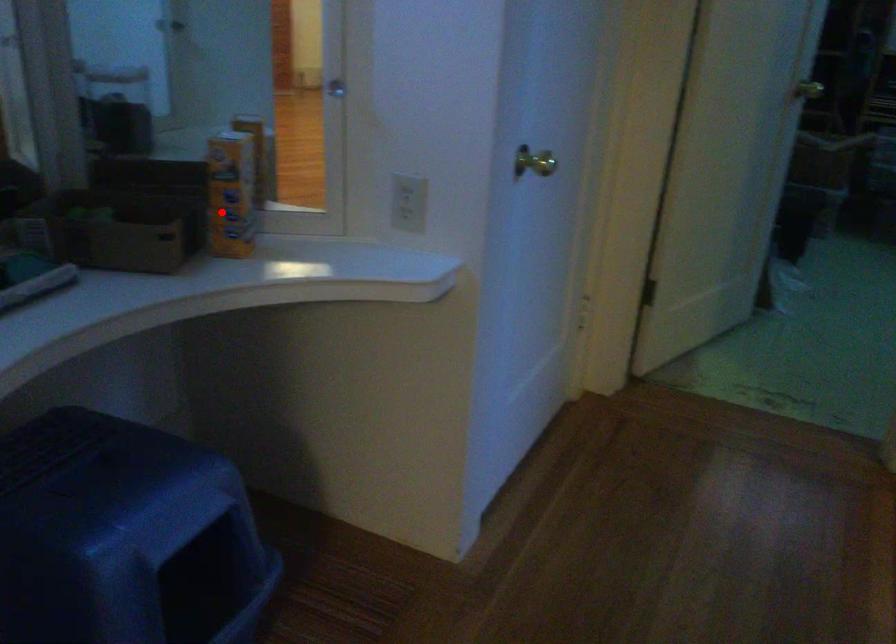
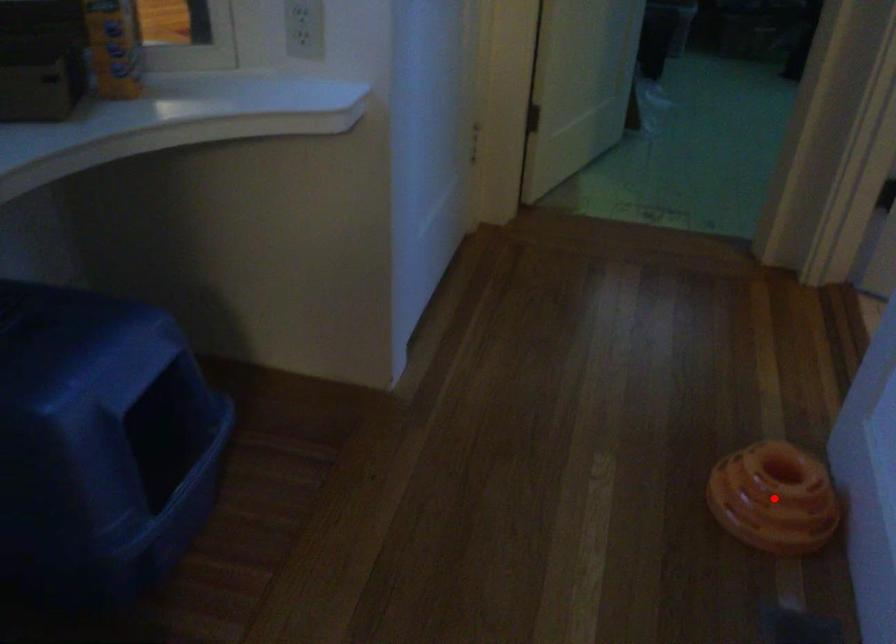
I am providing you with two images of the same scene from different viewpoints. A red point is marked on the first image and another point is marked on the second image. Is the marked point in image1 the same physical position as the marked point in image2?

No